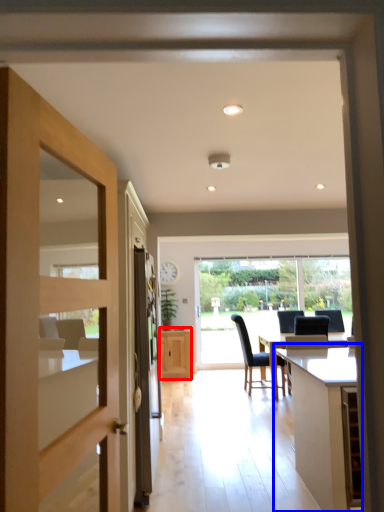
Question: Which of the following is the closest to the observer, cabinetry (highlighted by a red box) or table (highlighted by a blue box)?

Choices:
 (A) cabinetry
 (B) table

Answer: (B)